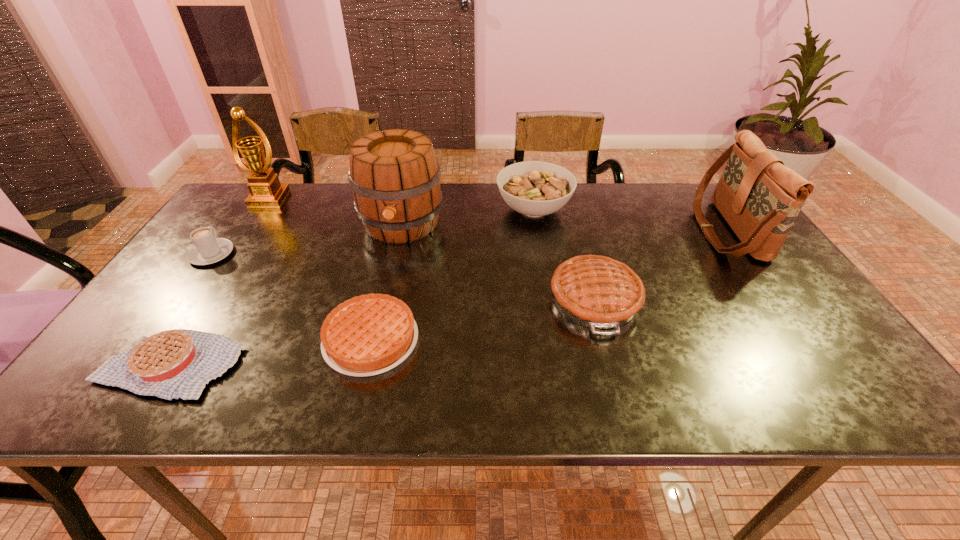
Image resolution: width=960 pixels, height=540 pixels. What are the coordinates of `award` in the screenshot? It's located at (265, 189).

Where is `cider`? This screenshot has width=960, height=540. cider is located at coordinates (395, 177).

Locate an element on the screen. This screenshot has height=540, width=960. the rightmost object is located at coordinates (760, 198).

This screenshot has width=960, height=540. Find the location of `stew`. stew is located at coordinates (534, 188).

Where is `the rightmost pie`? Image resolution: width=960 pixels, height=540 pixels. the rightmost pie is located at coordinates (598, 292).

Image resolution: width=960 pixels, height=540 pixels. What are the coordinates of `the fifth tallest object` in the screenshot? It's located at (598, 292).

The image size is (960, 540). What are the coordinates of `the sixth tallest object` in the screenshot? It's located at (208, 249).

Locate an element on the screen. Image resolution: width=960 pixels, height=540 pixels. the second pie from left to right is located at coordinates (367, 335).

Image resolution: width=960 pixels, height=540 pixels. What are the coordinates of `the leftmost pie` in the screenshot? It's located at (177, 363).

What are the coordinates of `free region located on the front-facing side of the award` in the screenshot? It's located at (229, 258).